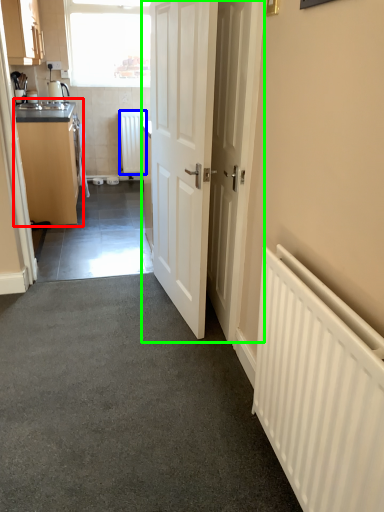
Question: Estimate the real-world distances between objects in this image. Which object is closer to cabinetry (highlighted by a red box), radiator (highlighted by a blue box) or door (highlighted by a green box)?

Choices:
 (A) radiator
 (B) door

Answer: (B)